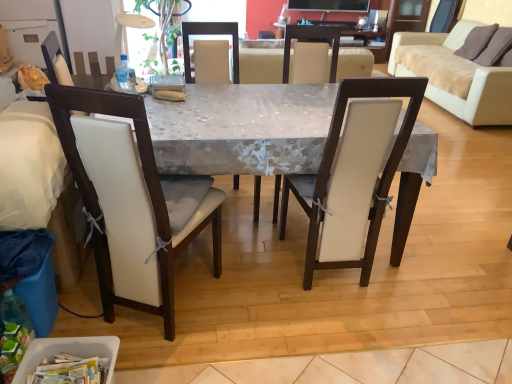
Question: From a real-world perspective, is white leather chair at left, which is the 1th chair in left-to-right order, positioned above or below beige fabric couch at upper right, which is counted as the first studio couch, starting from the right?

Choices:
 (A) below
 (B) above

Answer: (B)

Question: Do you think white leather chair at left, which is the 1th chair in left-to-right order, is within beige fabric couch at upper right, the first studio couch positioned from the back, or outside of it?

Choices:
 (A) inside
 (B) outside

Answer: (B)

Question: Estimate the real-world distances between objects in this image. Which object is closer to the white leather chair at center, acting as the fourth chair starting from the left?

Choices:
 (A) clear plastic bottle at table left
 (B) matte white table at center
 (C) brown fabric pillow at upper right
 (D) white fabric chair at center, which ranks as the second chair in right-to-left order
 (E) white leather studio couch at left, marked as the 1th studio couch in a left-to-right arrangement

Answer: (B)

Question: Based on their relative distances, which object is farther from the white fabric chair at center, which ranks as the second chair in right-to-left order?

Choices:
 (A) white leather chair at left, which is the 4th chair from right to left
 (B) white leather chair at center, which is counted as the 3th chair, starting from the right
 (C) matte white table at center
 (D) white leather studio couch at left, which is the 1th studio couch from front to back
 (E) brown fabric pillow at upper right

Answer: (E)